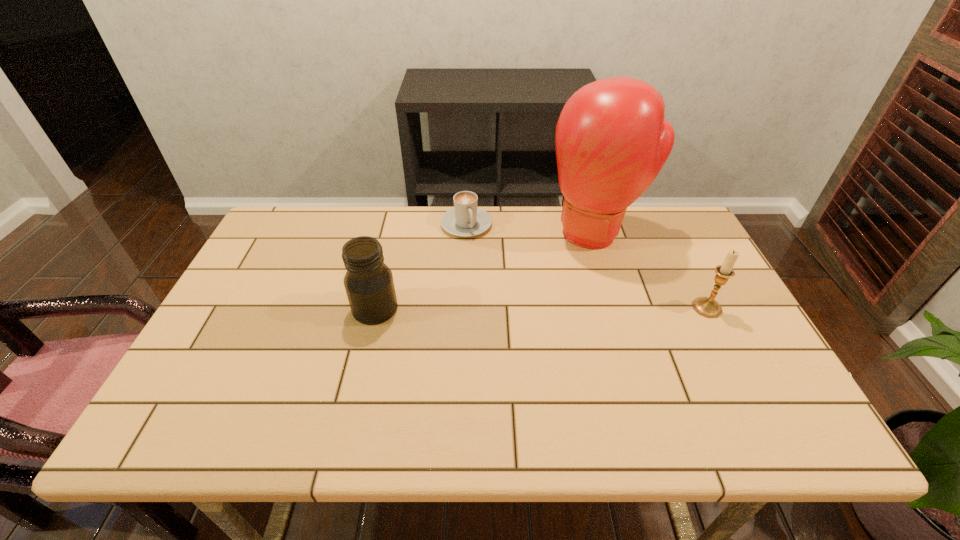
You are a GUI agent. You are given a task and a screenshot of the screen. Output one action in this format:
    pyautogui.click(x=<x>, y=<y>)
    Task: Click on the free space that is in between the candle holder and the boxing glove
    The image size is (960, 540).
    Given the screenshot: What is the action you would take?
    652,270

Identify the location of empty location between the rightmost object and the third object from left to right. This screenshot has width=960, height=540. (652, 270).

At what (x,y) coordinates should I click in order to perform the action: click on free space between the candle holder and the jar. Please return your answer as a coordinate pair (x, y). Looking at the image, I should click on (541, 308).

Image resolution: width=960 pixels, height=540 pixels. Identify the location of unoccupied position between the boxing glove and the rightmost object. (652, 270).

Where is `free point between the rightmost object and the tallest object`? free point between the rightmost object and the tallest object is located at coordinates (652, 270).

This screenshot has width=960, height=540. In order to click on the closest object relative to the jar in this screenshot , I will do `click(465, 219)`.

Find the location of `object identified as the closest to the third object from right to left`. object identified as the closest to the third object from right to left is located at coordinates (611, 140).

I want to click on free space in the image that satisfies the following two spatial constraints: 1. on the front side of the candle holder; 2. on the left side of the tallest object, so click(x=620, y=308).

Locate an element on the screen. vacant point that satisfies the following two spatial constraints: 1. on the back side of the rightmost object; 2. on the right side of the jar is located at coordinates (375, 308).

This screenshot has width=960, height=540. I want to click on free location that satisfies the following two spatial constraints: 1. on the front side of the cappuccino; 2. on the left side of the boxing glove, so click(x=466, y=232).